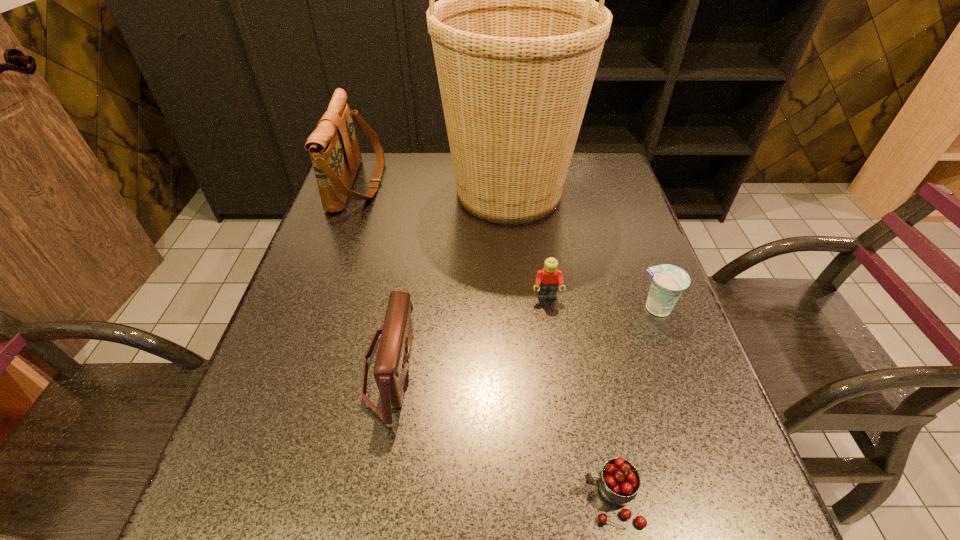
Identify the location of vacant space located on the front flap of the right shoulder bag. (492, 368).

At what (x,y) coordinates should I click in order to perform the action: click on free location located 0.060m on the face of the Lego. Please return your answer as a coordinate pair (x, y). Image resolution: width=960 pixels, height=540 pixels. Looking at the image, I should click on (551, 324).

Locate an element on the screen. The height and width of the screenshot is (540, 960). free region located on the front of the yogurt is located at coordinates (718, 475).

This screenshot has height=540, width=960. Identify the location of free space located 0.310m on the handle side of the cherry. (391, 498).

Where is `vacant space situated on the handle side of the cherry`? Image resolution: width=960 pixels, height=540 pixels. vacant space situated on the handle side of the cherry is located at coordinates pos(441,498).

This screenshot has height=540, width=960. I want to click on vacant space located 0.120m on the handle side of the cherry, so click(x=509, y=498).

At what (x,y) coordinates should I click in order to perform the action: click on basket that is at the far edge. Please return your answer as a coordinate pair (x, y). The height and width of the screenshot is (540, 960). Looking at the image, I should click on click(517, 37).

I want to click on shoulder bag at the far edge, so click(333, 146).

Find the location of a particular element. object that is at the near edge is located at coordinates (619, 481).

You are a GUI agent. You are given a task and a screenshot of the screen. Output one action in this format:
    pyautogui.click(x=<x>, y=<y>)
    Task: Click on the object that is at the left edge
    Image resolution: width=960 pixels, height=540 pixels.
    Given the screenshot: What is the action you would take?
    pyautogui.click(x=333, y=146)